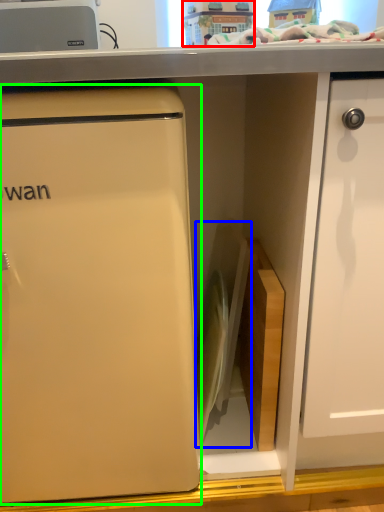
Question: Which object is the farthest from toy (highlighted by a red box)? Choose among these: appliance (highlighted by a blue box) or refrigerator (highlighted by a green box).

Choices:
 (A) appliance
 (B) refrigerator

Answer: (B)